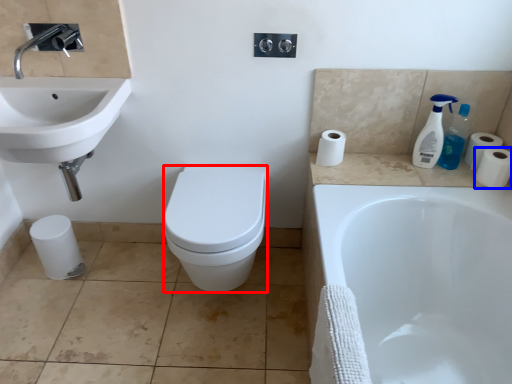
Question: Which object appears farthest to the camera in this image, bidet (highlighted by a red box) or toilet paper (highlighted by a blue box)?

Choices:
 (A) bidet
 (B) toilet paper

Answer: (B)